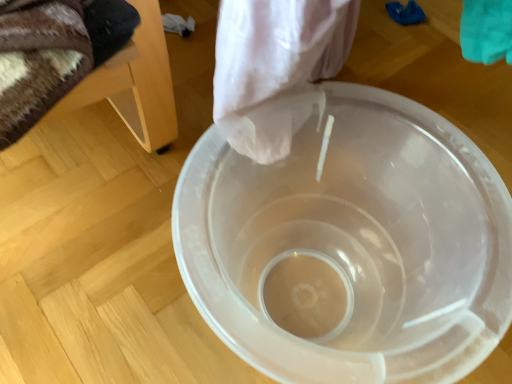
This screenshot has height=384, width=512. In order to click on free region under transparent plastic bucket at center (from a real-world perspective) in this screenshot , I will do `click(327, 288)`.